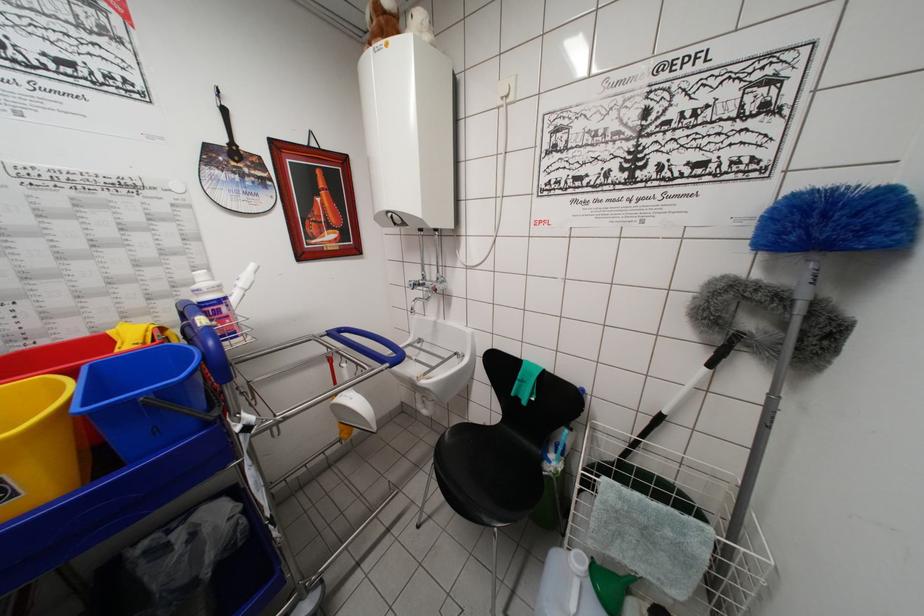
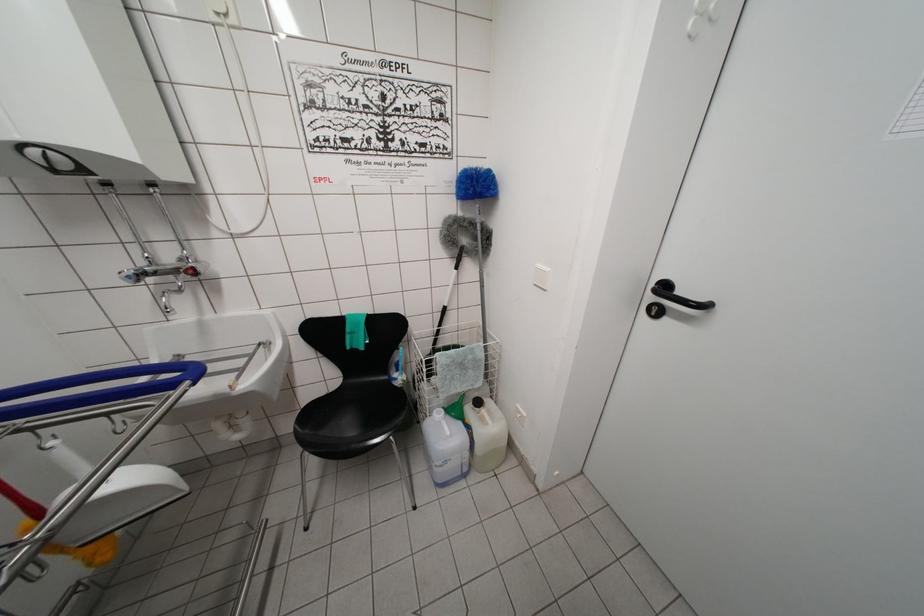
The point at (576, 557) is marked in the first image. Where is the corresponding point in the second image?

(438, 418)